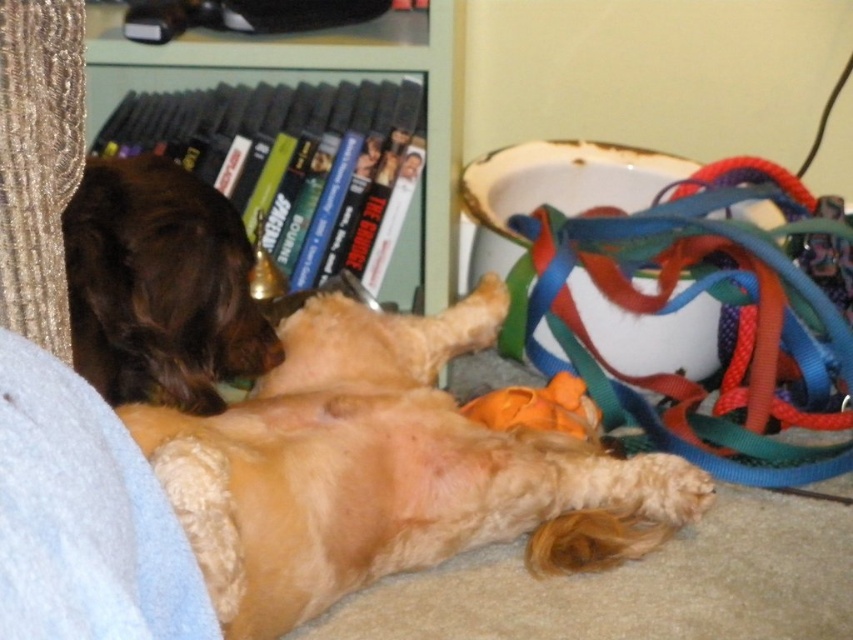
You are a delivery person trying to place a large package on the surface where the brown fuzzy dog at upper left and the black plastic bookshelf at upper left are located. Can you fit the package between them without disturbing the dog?

The brown fuzzy dog at upper left has a lesser height compared to the black plastic bookshelf at upper left, so the package can be placed between them as long as it doesn

You are a delivery robot trying to navigate to the green shelf. You see the fuzzy golden dog at center. Where should you go around the dog to reach the shelf?

The fuzzy golden dog at center is located at point (386,468). Since the dog is at the center, you should go around it either to the left or right to reach the green shelf.

You are a delivery robot with a package that is 20 inches long. You need to move through the space between the brown fuzzy dog at upper left and the black plastic bookshelf at upper left. Can the package fit through that space?

The distance between the brown fuzzy dog at upper left and the black plastic bookshelf at upper left is 18.65 inches. Since the package is 20 inches long, it cannot fit through the space between them.